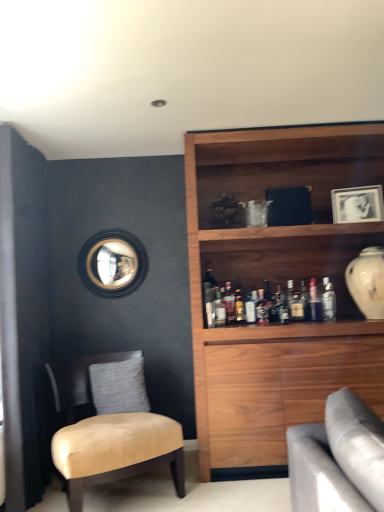
Question: Is point (301, 287) positioned closer to the camera than point (375, 258)?

Choices:
 (A) closer
 (B) farther

Answer: (B)

Question: Would you say matte glass bottle at upper right, which is the 3th bottle from right to left, is to the left or to the right of white glossy vase at upper right in the picture?

Choices:
 (A) left
 (B) right

Answer: (A)

Question: Based on their relative distances, which object is farther from the gray textured pillow at center-left?

Choices:
 (A) tan leather chair at left
 (B) matte glass bottle at upper right, which is the 3th bottle from right to left
 (C) matte glass bottle at shelf center
 (D) white glossy vase at upper right
 (E) matte black mirror at upper left

Answer: (D)

Question: Estimate the real-world distances between objects in this image. Which object is closer to the gray textured pillow at center-left?

Choices:
 (A) clear glass bottle at upper right, arranged as the seventh bottle when viewed from the left
 (B) matte glass bottle at shelf center
 (C) translucent glass bottle at shelf center, acting as the 5th bottle starting from the right
 (D) matte glass bottle at upper right, which is the 3th bottle from right to left
 (E) matte black mirror at upper left

Answer: (E)